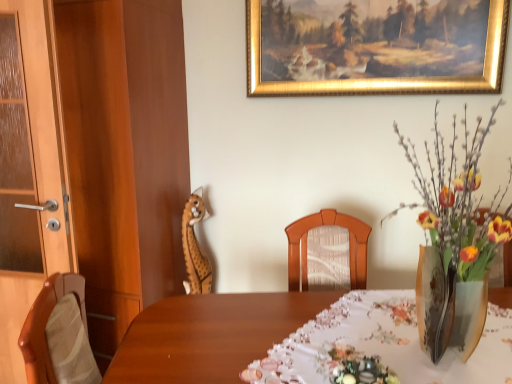
Question: From a real-world perspective, is wooden door at left above or below translucent glass vase at right?

Choices:
 (A) above
 (B) below

Answer: (B)

Question: In the image, is wooden door at left positioned in front of or behind translucent glass vase at right?

Choices:
 (A) front
 (B) behind

Answer: (B)

Question: Which object is positioned farthest from the translucent glass vase at right?

Choices:
 (A) wooden giraffe at upper left
 (B) wooden table at center
 (C) wooden door at left
 (D) matte wood dresser at left
 (E) gold-framed painting at upper center

Answer: (C)

Question: Which is nearer to the translucent glass vase at right?

Choices:
 (A) gold-framed painting at upper center
 (B) wooden table at center
 (C) wooden giraffe at upper left
 (D) wooden door at left
 (E) matte wood dresser at left

Answer: (B)